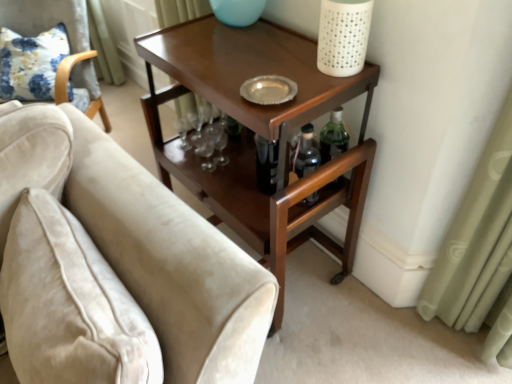
Question: Is velvet beige armchair at left behind floral fabric pillow at upper left?

Choices:
 (A) no
 (B) yes

Answer: (A)

Question: Considering the relative sizes of velvet beige armchair at left and floral fabric pillow at upper left in the image provided, is velvet beige armchair at left thinner than floral fabric pillow at upper left?

Choices:
 (A) yes
 (B) no

Answer: (B)

Question: From the image's perspective, would you say velvet beige armchair at left is shown under floral fabric pillow at upper left?

Choices:
 (A) no
 (B) yes

Answer: (B)

Question: Can you confirm if velvet beige armchair at left is positioned to the left of floral fabric pillow at upper left?

Choices:
 (A) no
 (B) yes

Answer: (B)

Question: From the image's perspective, is velvet beige armchair at left above floral fabric pillow at upper left?

Choices:
 (A) no
 (B) yes

Answer: (A)

Question: Considering the relative positions of velvet beige armchair at left and floral fabric pillow at upper left in the image provided, is velvet beige armchair at left in front of floral fabric pillow at upper left?

Choices:
 (A) no
 (B) yes

Answer: (B)

Question: Is shiny brown wood side table at center facing towards velvet beige armchair at left?

Choices:
 (A) yes
 (B) no

Answer: (B)

Question: Is shiny brown wood side table at center thinner than velvet beige armchair at left?

Choices:
 (A) yes
 (B) no

Answer: (A)

Question: Considering the relative sizes of shiny brown wood side table at center and velvet beige armchair at left in the image provided, is shiny brown wood side table at center smaller than velvet beige armchair at left?

Choices:
 (A) no
 (B) yes

Answer: (B)

Question: Does shiny brown wood side table at center have a larger size compared to velvet beige armchair at left?

Choices:
 (A) yes
 (B) no

Answer: (B)

Question: From the image's perspective, is shiny brown wood side table at center above velvet beige armchair at left?

Choices:
 (A) yes
 (B) no

Answer: (B)

Question: Is the depth of shiny brown wood side table at center less than that of velvet beige armchair at left?

Choices:
 (A) yes
 (B) no

Answer: (A)

Question: From a real-world perspective, is velvet beige armchair at left positioned under shiny brown wood side table at center based on gravity?

Choices:
 (A) yes
 (B) no

Answer: (B)